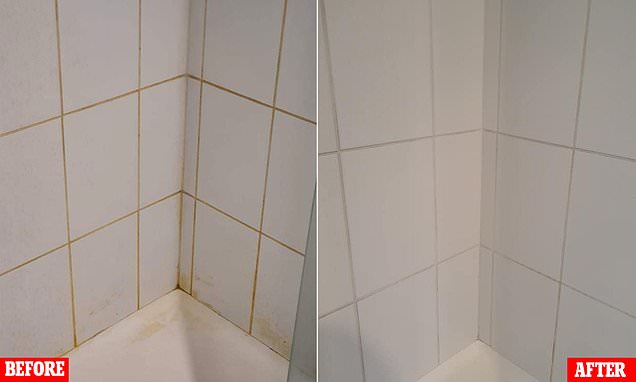
Locate an element on the screen. This screenshot has width=636, height=382. stain on white tile is located at coordinates (102, 302).